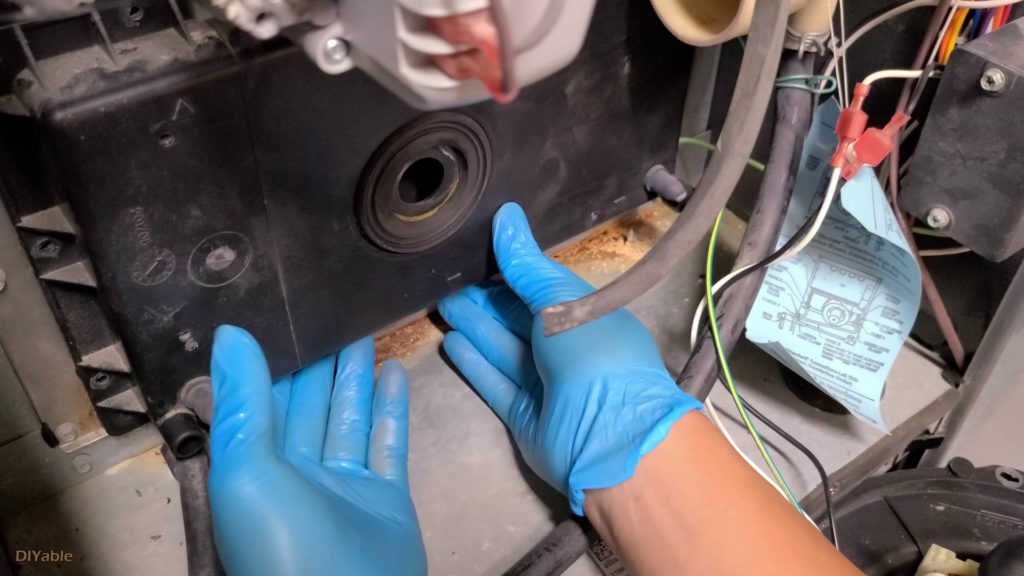
What are the coordinates of `white cable` in the screenshot? It's located at (833, 184).